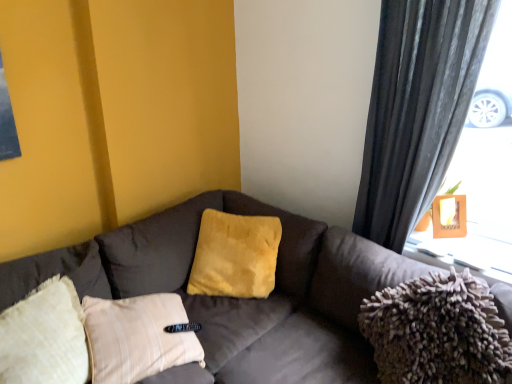
Question: Is yellow plush pillow at center to the left or to the right of dark gray textured curtain at right in the image?

Choices:
 (A) left
 (B) right

Answer: (A)

Question: Considering the positions of yellow plush pillow at center and dark gray textured curtain at right in the image, is yellow plush pillow at center taller or shorter than dark gray textured curtain at right?

Choices:
 (A) short
 (B) tall

Answer: (A)

Question: Which object is positioned closest to the velvet brown couch at center?

Choices:
 (A) wooden frame at upper right
 (B) yellow plush pillow at center
 (C) wooden frame at upper right
 (D) fuzzy fabric pillow at right
 (E) dark gray textured curtain at right

Answer: (B)

Question: Which object is the closest to the velvet brown couch at center?

Choices:
 (A) wooden frame at upper right
 (B) fuzzy fabric pillow at right
 (C) yellow plush pillow at center
 (D) wooden frame at upper right
 (E) dark gray textured curtain at right

Answer: (C)